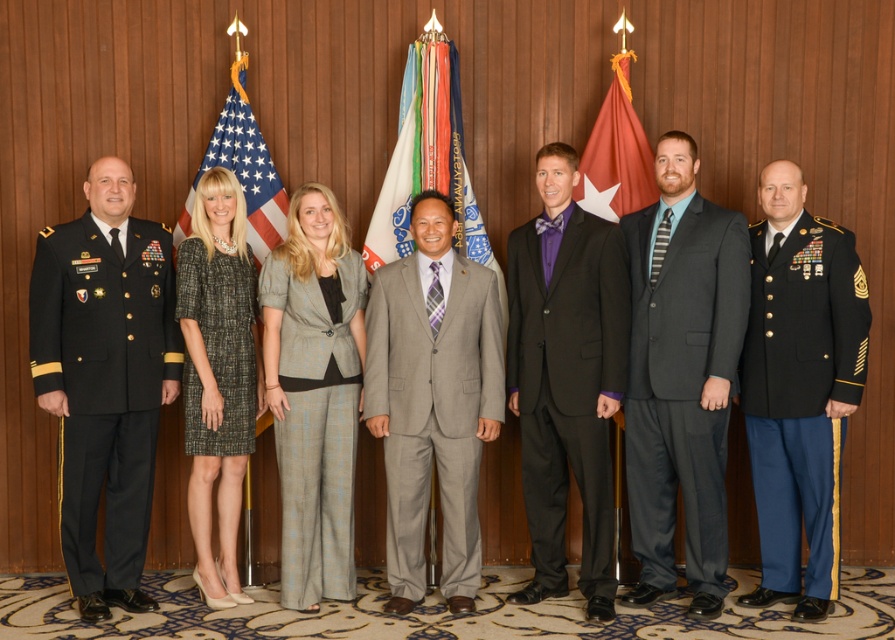
Does gray wool suit at center have a greater height compared to gray tweed suit at center?

No.

Can you confirm if gray wool suit at center is wider than gray tweed suit at center?

Yes, gray wool suit at center is wider than gray tweed suit at center.

Does point (401, 444) come closer to viewer compared to point (331, 205)?

Yes, point (401, 444) is in front of point (331, 205).

The width and height of the screenshot is (895, 640). I want to click on gray wool suit at center, so click(432, 400).

The width and height of the screenshot is (895, 640). What do you see at coordinates (800, 394) in the screenshot? I see `dark blue wool military uniform at right` at bounding box center [800, 394].

Does dark blue wool military uniform at right appear over red fabric flag at center?

Actually, dark blue wool military uniform at right is below red fabric flag at center.

Describe the element at coordinates (800, 394) in the screenshot. This screenshot has height=640, width=895. I see `dark blue wool military uniform at right` at that location.

At what (x,y) coordinates should I click in order to perform the action: click on dark blue wool military uniform at right. Please return your answer as a coordinate pair (x, y). The image size is (895, 640). Looking at the image, I should click on (800, 394).

Is point (766, 252) positioned after point (245, 125)?

No, (766, 252) is in front of (245, 125).

At what (x,y) coordinates should I click in order to perform the action: click on dark blue wool military uniform at right. Please return your answer as a coordinate pair (x, y). Image resolution: width=895 pixels, height=640 pixels. Looking at the image, I should click on (800, 394).

Between point (810, 445) and point (210, 150), which one is positioned in front?

Point (810, 445) is in front.

Find the location of `dark blue wool military uniform at right`. dark blue wool military uniform at right is located at coordinates (800, 394).